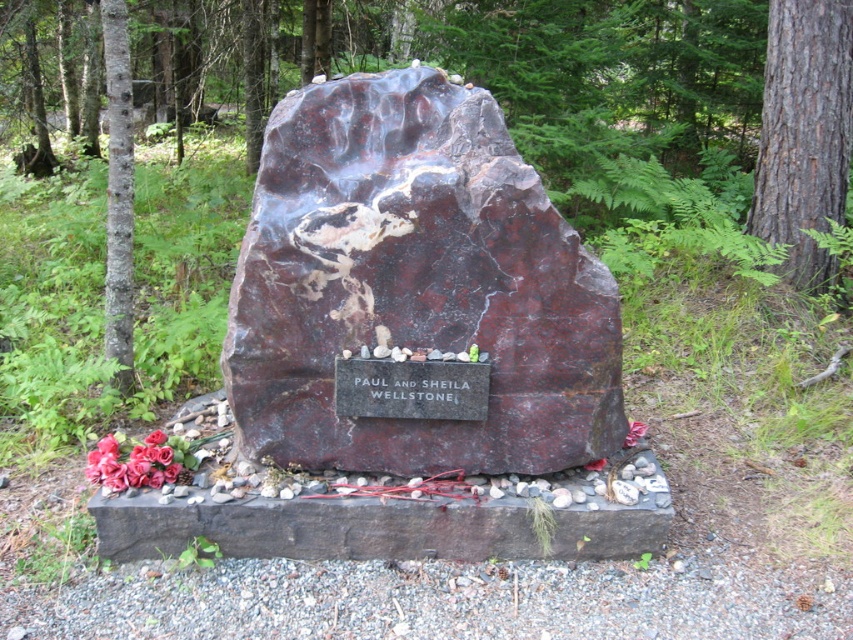
You are standing in front of the memorial stone and want to take a photo that includes both the memorial stone and the brown rough bark tree at right. If your camera has a maximum focus range of 4 meters, will the tree be in focus?

The brown rough bark tree at right is 4.04 meters away from camera, which is slightly beyond the camera maximum focus range of 4 meters. Therefore, the tree will not be in focus.

You are standing in front of the memorial stone and want to take a photo of both brown rough bark tree at right and brown rough bark tree at left. Which tree should you position closer to the memorial stone to include both in the frame?

To include both the brown rough bark tree at right and the brown rough bark tree at left in the frame, position yourself closer to the memorial stone. Since the brown rough bark tree at right is much taller than the brown rough bark tree at left, angling the camera to capture both their bases near the memorial stone while including their tops might require a wider lens or adjusting your position to ensure both are visible. However, since the question specifically asks which tree to position closer to the me